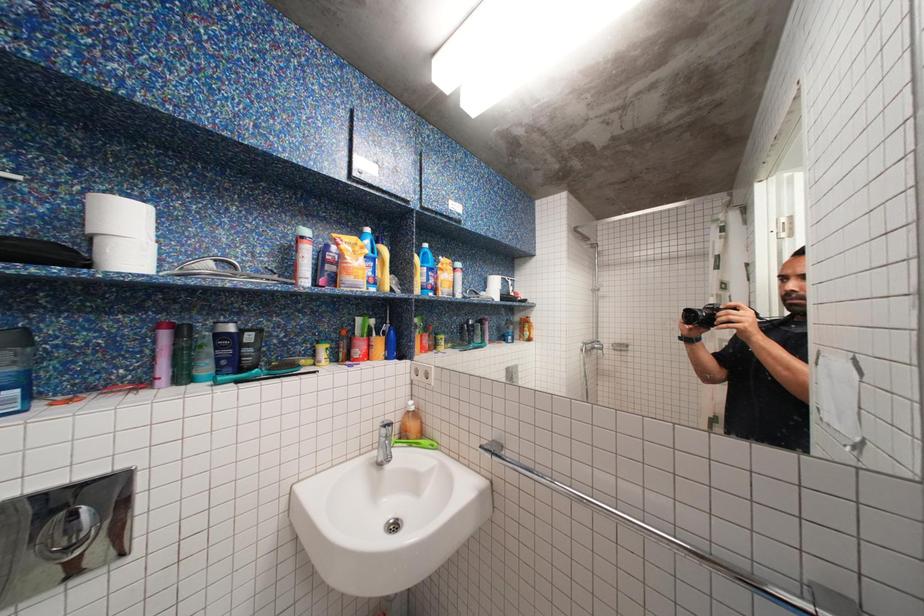
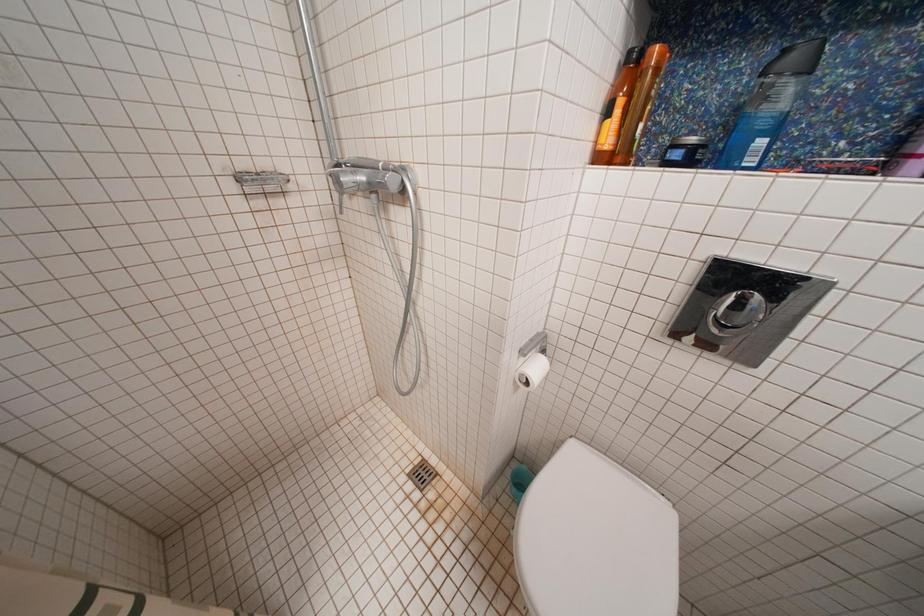
First-person continuous shooting, in which direction is the camera rotating?

The camera's rotation is toward left-down.